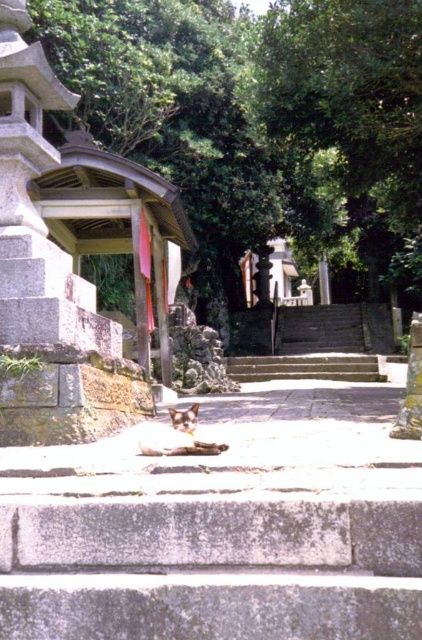
Can you confirm if smooth concrete stairs at center is wider than gray concrete stairs at center?

Indeed, smooth concrete stairs at center has a greater width compared to gray concrete stairs at center.

Can you confirm if smooth concrete stairs at center is smaller than gray concrete stairs at center?

Incorrect, smooth concrete stairs at center is not smaller in size than gray concrete stairs at center.

Between point (368, 372) and point (294, 364), which one is positioned behind?

The point (294, 364) is more distant.

The width and height of the screenshot is (422, 640). What are the coordinates of `smooth concrete stairs at center` in the screenshot? It's located at (311, 342).